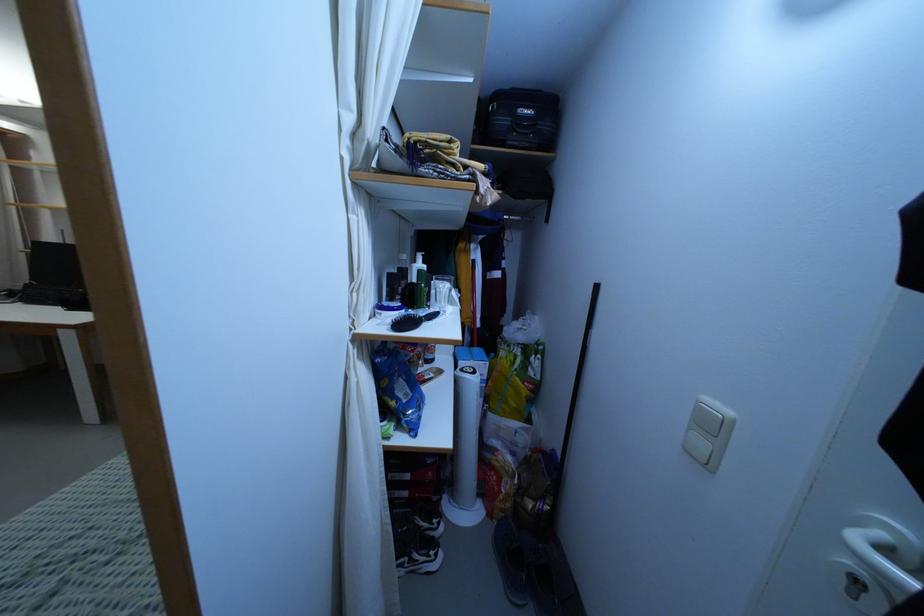
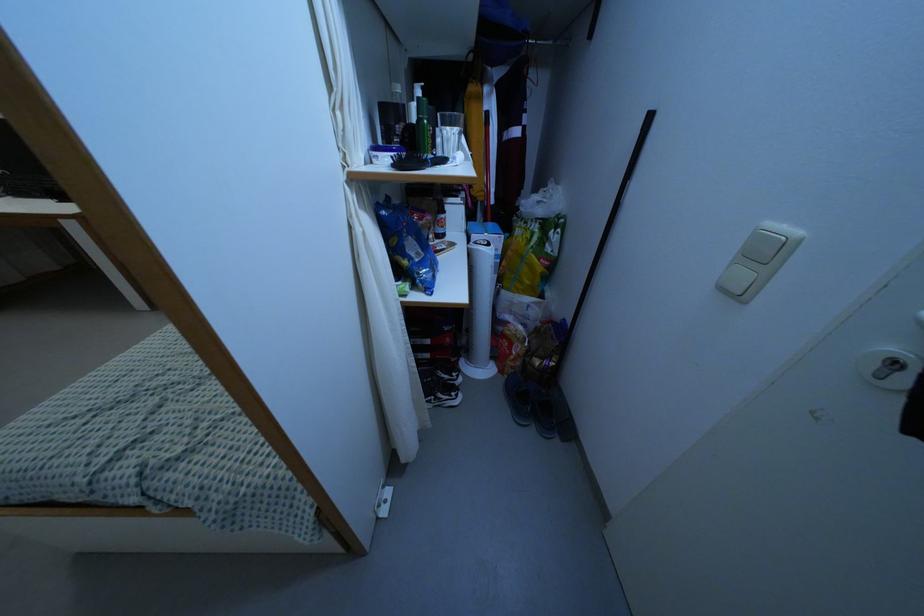
In the second image, find the point that corresponds to (857,582) in the first image.

(894, 363)